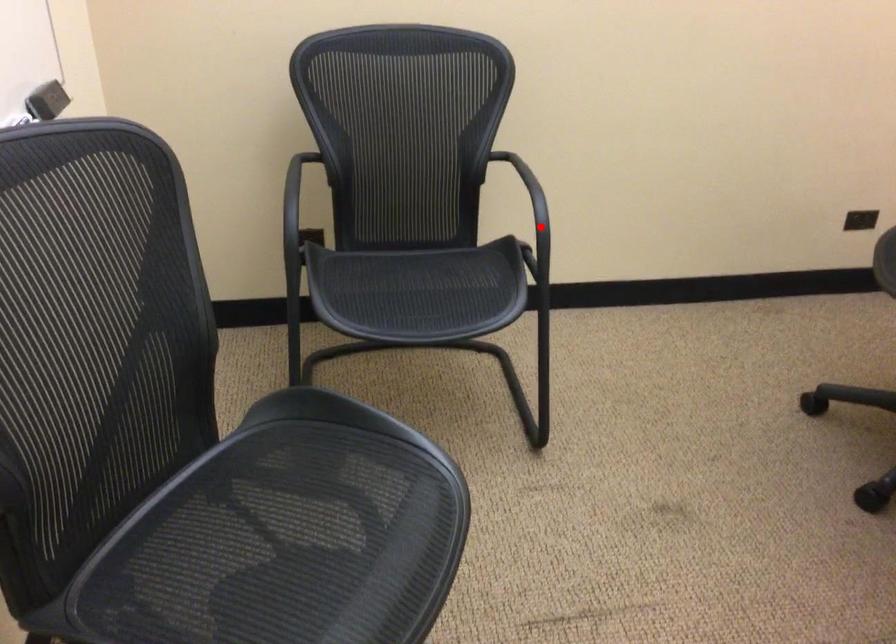
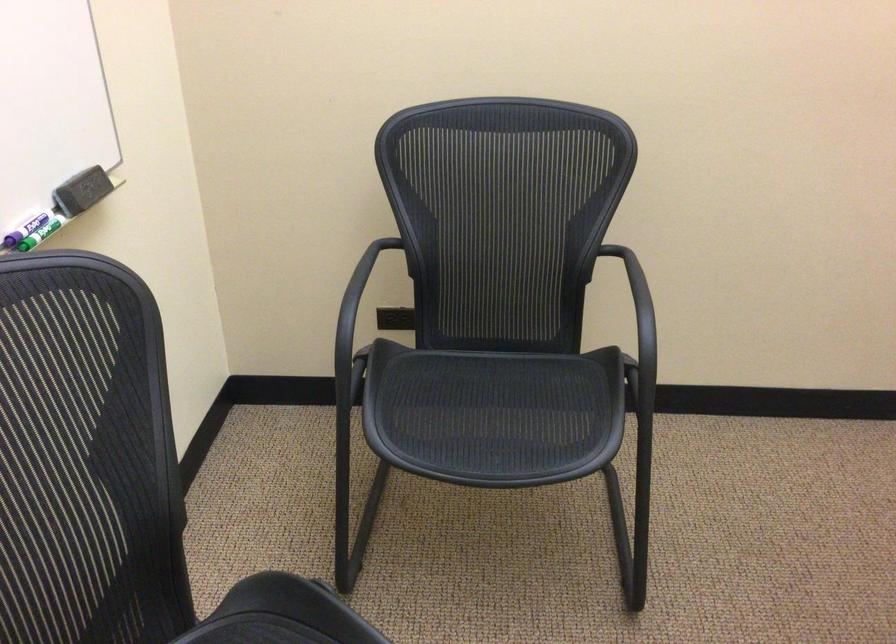
Locate, in the second image, the point that corresponds to the highlighted location in the first image.

(639, 348)